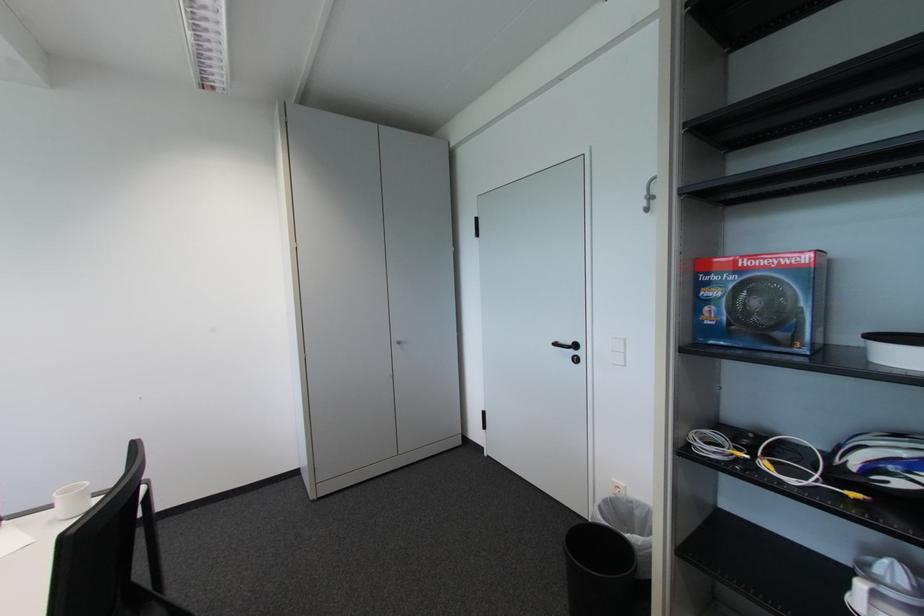
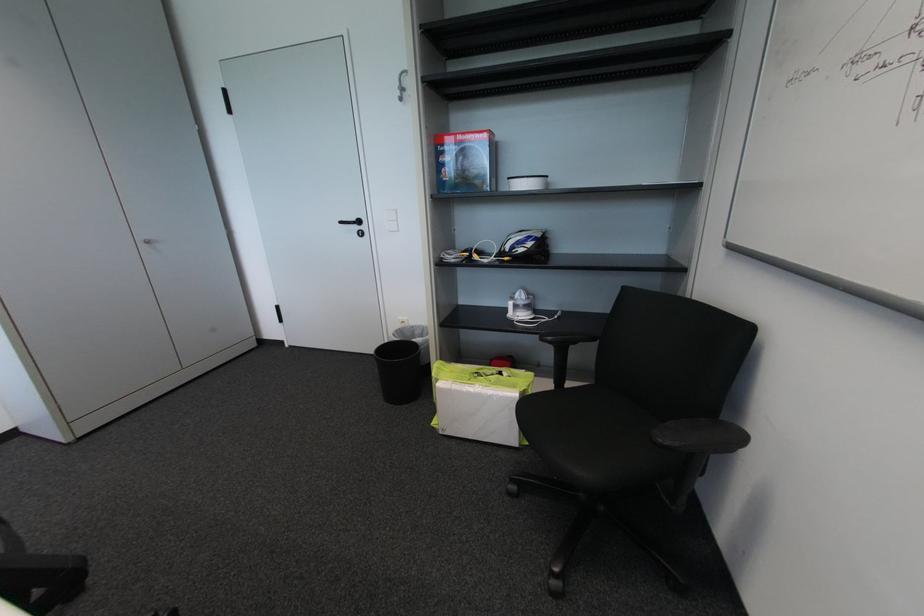
Question: I am providing you with two images of the same scene from different viewpoints. After the viewpoint changes to image2, which objects are now occluded?

Choices:
 (A) white light switch
 (B) lime green tote bag
 (C) silver cabinet handle
 (D) none of these

Answer: (D)